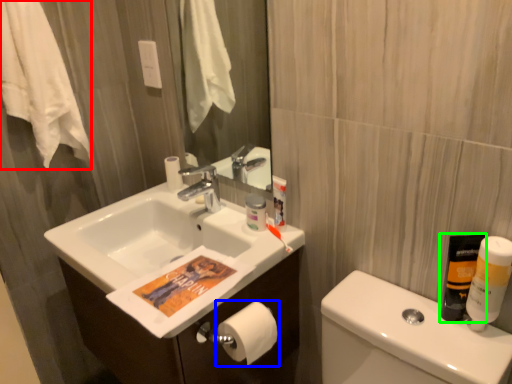
Question: Estimate the real-world distances between objects in this image. Which object is closer to bath towel (highlighted by a red box), toilet paper (highlighted by a blue box) or mouthwash (highlighted by a green box)?

Choices:
 (A) toilet paper
 (B) mouthwash

Answer: (A)